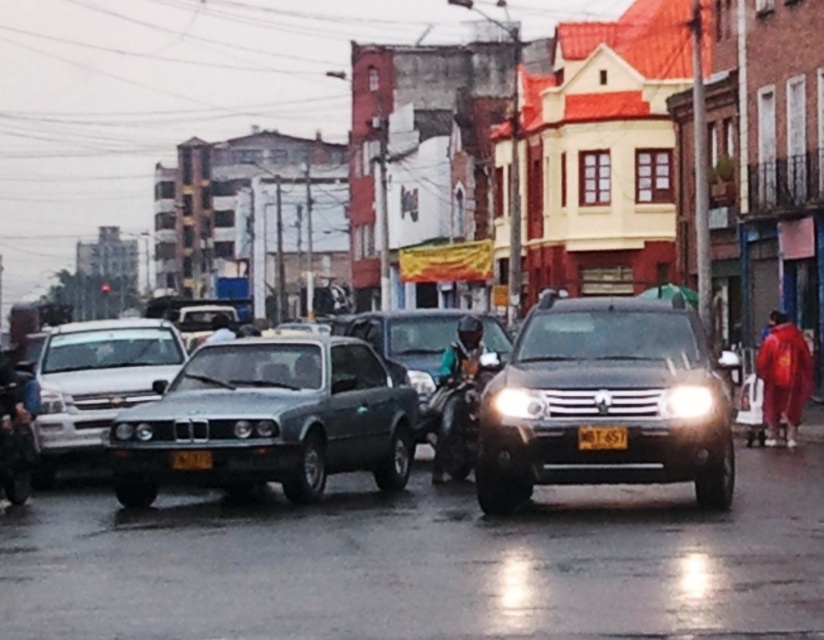
Question: Which point is closer to the camera taking this photo?

Choices:
 (A) (17, 451)
 (B) (467, 442)
 (C) (780, 401)

Answer: (A)

Question: Which point is farther to the camera?

Choices:
 (A) silver metallic sedan at center
 (B) matte black headlight at center

Answer: (A)

Question: Does red fabric person at right appear over matte black headlight at center?

Choices:
 (A) yes
 (B) no

Answer: (B)

Question: Which object is positioned closest to the silver metallic sedan at center?

Choices:
 (A) yellow matte license plate at center
 (B) satin black suv at center
 (C) matte black headlight at center
 (D) black plastic license plate at center

Answer: (A)

Question: Is red fabric person at right thinner than glossy plastic headlight at center?

Choices:
 (A) no
 (B) yes

Answer: (A)

Question: Where is satin black suv at center located in relation to satin silver car at center in the image?

Choices:
 (A) below
 (B) above

Answer: (B)